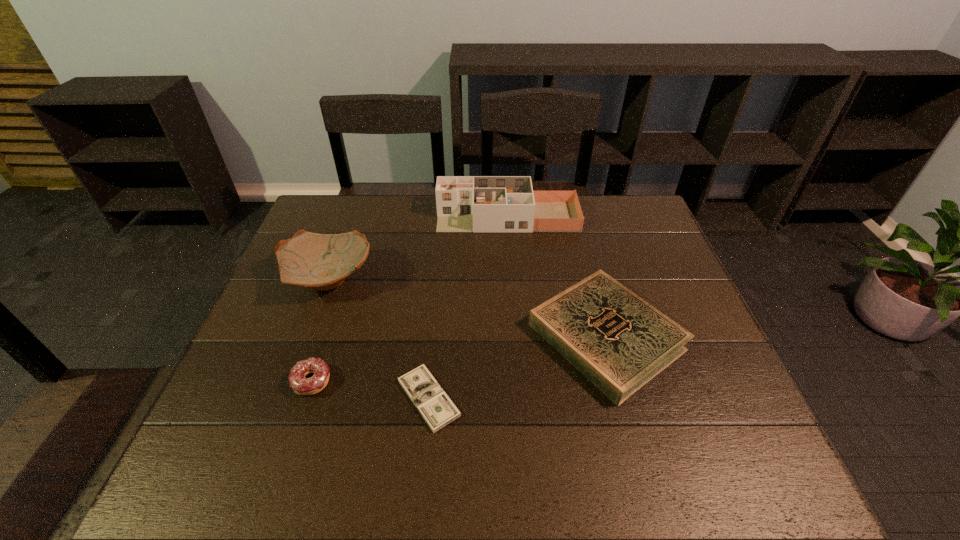
Locate an element on the screen. This screenshot has width=960, height=540. blank region between the dollar and the farthest object is located at coordinates (468, 307).

Locate an element on the screen. The image size is (960, 540). object that ranks as the second closest to the dollar is located at coordinates (617, 340).

At what (x,y) coordinates should I click in order to perform the action: click on object that is the fourth nearest to the dollhouse. Please return your answer as a coordinate pair (x, y). The width and height of the screenshot is (960, 540). Looking at the image, I should click on (301, 385).

Find the location of a particular element. Image resolution: width=960 pixels, height=540 pixels. vacant space that satisfies the following two spatial constraints: 1. at the front door of the farthest object; 2. on the right side of the hardback book is located at coordinates (516, 336).

Find the location of a particular element. This screenshot has width=960, height=540. free spot that satisfies the following two spatial constraints: 1. on the front side of the pottery; 2. on the right side of the hardback book is located at coordinates (307, 336).

At what (x,y) coordinates should I click in order to perform the action: click on vacant area that satisfies the following two spatial constraints: 1. at the front door of the farthest object; 2. on the front side of the fourth tallest object. Please return your answer as a coordinate pair (x, y). Looking at the image, I should click on (520, 382).